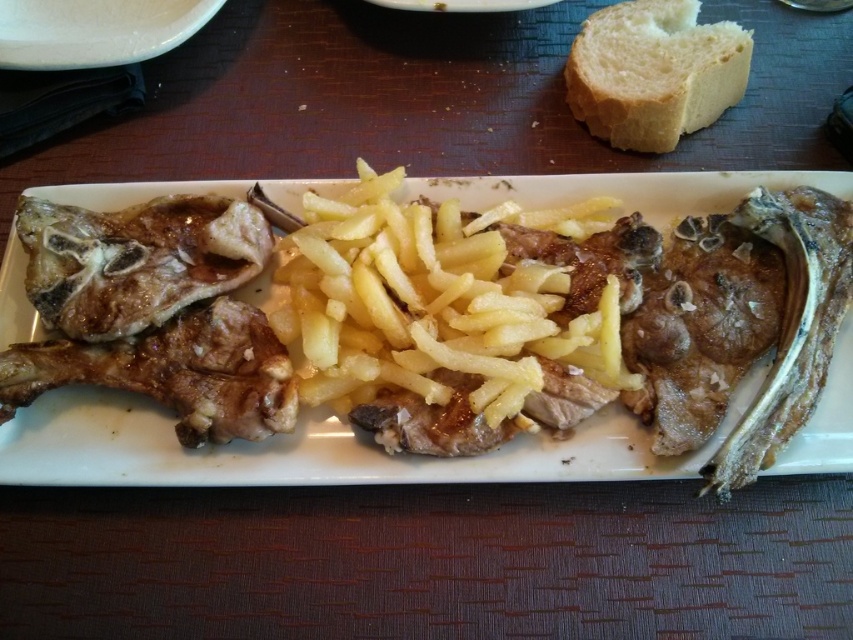
Question: Is golden brown crispy fries at center smaller than white soft bread at upper right?

Choices:
 (A) no
 (B) yes

Answer: (A)

Question: Is golden brown crispy fries at center positioned at the back of white soft bread at upper right?

Choices:
 (A) yes
 (B) no

Answer: (B)

Question: Which point is farther to the camera?

Choices:
 (A) (721, 65)
 (B) (32, 412)

Answer: (A)

Question: Which point is farther from the camera taking this photo?

Choices:
 (A) pyautogui.click(x=631, y=10)
 (B) pyautogui.click(x=1, y=323)

Answer: (A)

Question: Which point is farther to the camera?

Choices:
 (A) (598, 72)
 (B) (68, 451)

Answer: (A)

Question: Can you confirm if golden brown crispy fries at center is smaller than white soft bread at upper right?

Choices:
 (A) yes
 (B) no

Answer: (B)